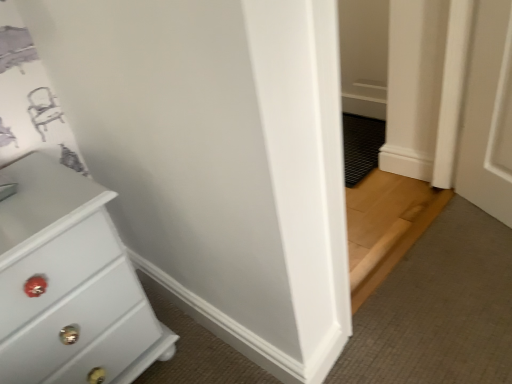
What is the approximate height of white glossy chest of drawers at lower left?

white glossy chest of drawers at lower left is 23.27 inches in height.

Describe the element at coordinates (69, 285) in the screenshot. I see `white glossy chest of drawers at lower left` at that location.

Where is `white glossy chest of drawers at lower left`? The width and height of the screenshot is (512, 384). white glossy chest of drawers at lower left is located at coordinates (69, 285).

This screenshot has width=512, height=384. Find the location of `white glossy chest of drawers at lower left`. white glossy chest of drawers at lower left is located at coordinates (69, 285).